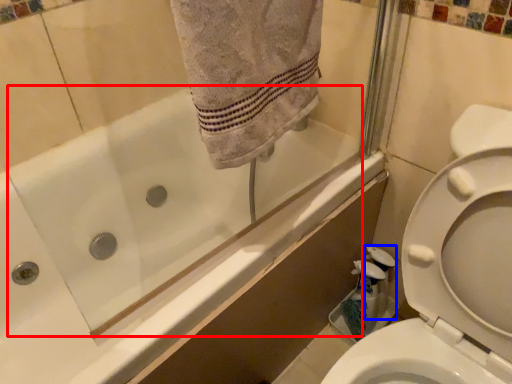
Question: Among these objects, which one is farthest to the camera, bath (highlighted by a red box) or cleaning product (highlighted by a blue box)?

Choices:
 (A) bath
 (B) cleaning product

Answer: (B)